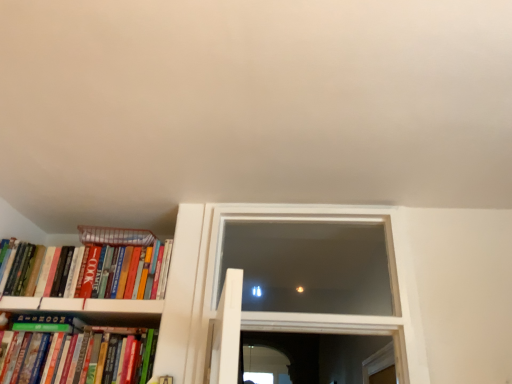
Question: Is striped paper at left turned away from hardcover books at left, positioned as the 1th book in top-to-bottom order?

Choices:
 (A) yes
 (B) no

Answer: (B)

Question: Is striped paper at left shorter than hardcover books at left, acting as the second book starting from the bottom?

Choices:
 (A) no
 (B) yes

Answer: (B)

Question: Is striped paper at left aimed at hardcover books at left, acting as the second book starting from the bottom?

Choices:
 (A) no
 (B) yes

Answer: (A)

Question: Is striped paper at left to the right of hardcover books at left, acting as the second book starting from the bottom, from the viewer's perspective?

Choices:
 (A) no
 (B) yes

Answer: (B)

Question: From the image's perspective, does striped paper at left appear lower than hardcover books at left, acting as the second book starting from the bottom?

Choices:
 (A) no
 (B) yes

Answer: (A)

Question: Would you say striped paper at left is outside hardcover books at left, positioned as the 1th book in top-to-bottom order?

Choices:
 (A) yes
 (B) no

Answer: (A)

Question: Is hardcover books at left, positioned as the 1th book in top-to-bottom order, behind transparent glass window at center?

Choices:
 (A) no
 (B) yes

Answer: (B)

Question: Is hardcover books at left, acting as the second book starting from the bottom, to the right of transparent glass window at center from the viewer's perspective?

Choices:
 (A) no
 (B) yes

Answer: (A)

Question: Considering the relative sizes of hardcover books at left, acting as the second book starting from the bottom, and transparent glass window at center in the image provided, is hardcover books at left, acting as the second book starting from the bottom, shorter than transparent glass window at center?

Choices:
 (A) no
 (B) yes

Answer: (B)

Question: Can you confirm if hardcover books at left, acting as the second book starting from the bottom, is smaller than transparent glass window at center?

Choices:
 (A) yes
 (B) no

Answer: (A)

Question: Is hardcover books at left, acting as the second book starting from the bottom, to the left of transparent glass window at center from the viewer's perspective?

Choices:
 (A) yes
 (B) no

Answer: (A)

Question: Can transparent glass window at center be found inside hardcover books at left, acting as the second book starting from the bottom?

Choices:
 (A) yes
 (B) no

Answer: (B)

Question: Is hardcover books at left, positioned as the 1th book in top-to-bottom order, turned away from green matte bookshelf at lower left, arranged as the 1th book when ordered from the bottom?

Choices:
 (A) yes
 (B) no

Answer: (B)